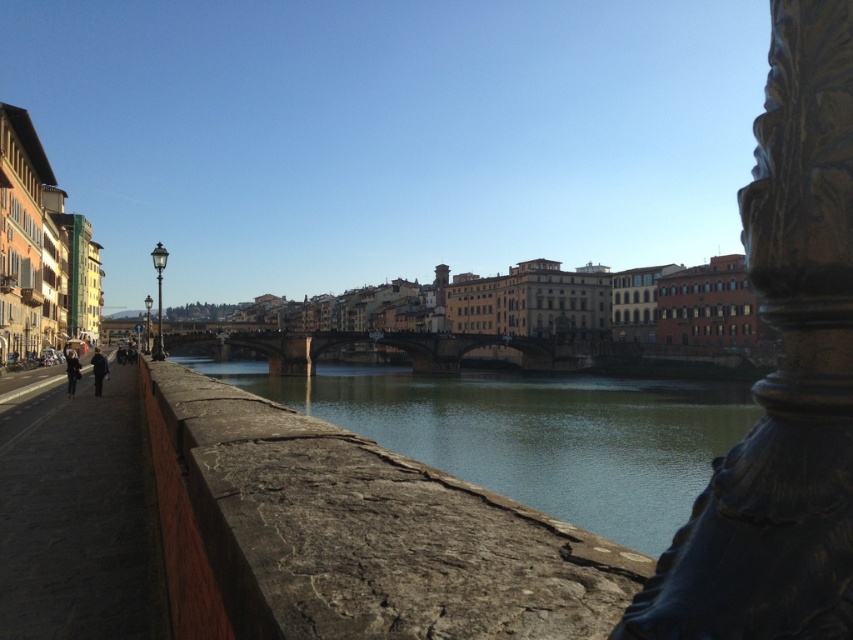
Question: Which object is positioned closest to the stone bridge at center?

Choices:
 (A) green stone river at center
 (B) dark brown leather jacket at left
 (C) dark blue fabric at left

Answer: (A)

Question: Can you confirm if stone bridge at center is wider than dark brown leather jacket at left?

Choices:
 (A) yes
 (B) no

Answer: (A)

Question: Which of these objects is positioned closest to the dark blue fabric at left?

Choices:
 (A) dark brown leather jacket at left
 (B) stone bridge at center

Answer: (A)

Question: Is green stone river at center positioned before stone bridge at center?

Choices:
 (A) yes
 (B) no

Answer: (A)

Question: Which of the following is the closest to the observer?

Choices:
 (A) (558, 388)
 (B) (415, 364)
 (C) (67, 368)
 (D) (99, 392)

Answer: (D)

Question: Can you confirm if green stone river at center is positioned to the right of dark blue fabric at left?

Choices:
 (A) no
 (B) yes

Answer: (B)